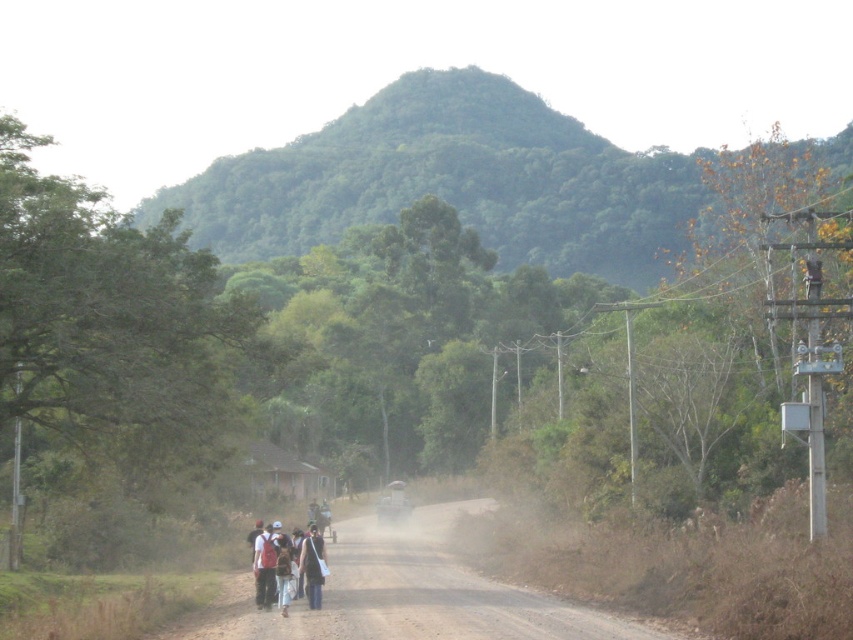
Question: Which object appears closest to the camera in this image?

Choices:
 (A) white cotton shirt at center
 (B) metallic silver motorcycle at center
 (C) dark blue fabric jacket at center

Answer: (A)

Question: Can you confirm if brown dusty road at center is positioned to the right of dark blue fabric jacket at center?

Choices:
 (A) no
 (B) yes

Answer: (A)

Question: Which of the following is the closest to the observer?

Choices:
 (A) (196, 624)
 (B) (381, 500)
 (C) (270, 554)
 (D) (305, 538)

Answer: (A)

Question: Can you confirm if brown dusty road at center is positioned to the right of metallic silver motorcycle at center?

Choices:
 (A) no
 (B) yes

Answer: (B)

Question: Observing the image, what is the correct spatial positioning of brown dusty road at center in reference to metallic silver motorcycle at center?

Choices:
 (A) below
 (B) above

Answer: (B)

Question: Which point is closer to the camera taking this photo?

Choices:
 (A) (310, 540)
 (B) (305, 532)

Answer: (A)